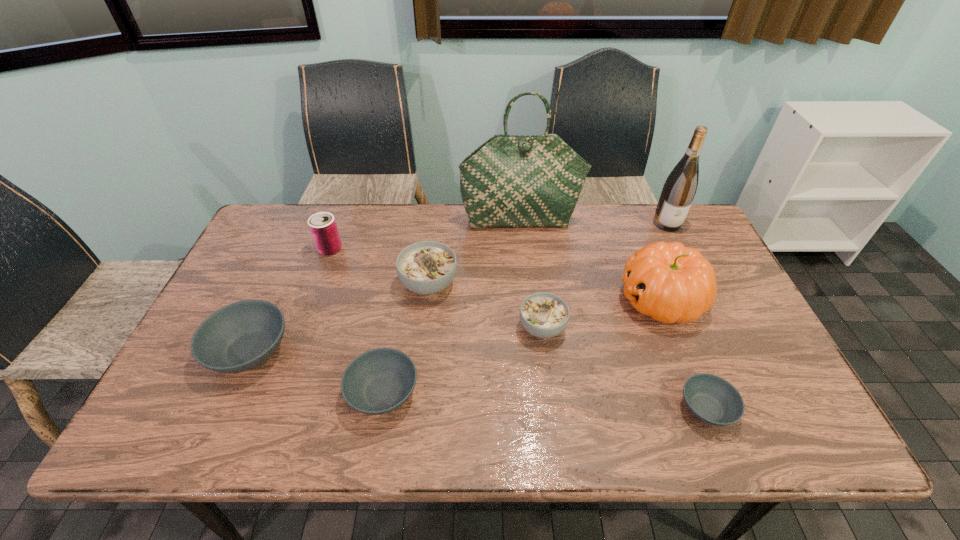
Image resolution: width=960 pixels, height=540 pixels. What are the coordinates of `vacant space located 0.270m on the carved face of the orange pumpkin` in the screenshot? It's located at (521, 299).

In order to click on free space located 0.250m on the carved face of the orange pumpkin in this screenshot , I will do `click(529, 299)`.

Locate an element on the screen. The image size is (960, 540). free region located on the carved face of the orange pumpkin is located at coordinates (521, 299).

I want to click on free location located 0.100m on the right of the third farthest object, so [x=374, y=249].

Locate an element on the screen. free space located 0.220m on the left of the bigger white soup bowl is located at coordinates (324, 284).

I want to click on free point located 0.310m on the right of the biggest gray soup bowl, so click(x=415, y=351).

The width and height of the screenshot is (960, 540). I want to click on vacant space located 0.090m on the back of the right white soup bowl, so click(537, 286).

The height and width of the screenshot is (540, 960). In order to click on blank space located on the left of the second gray soup bowl from left to right in this screenshot , I will do `click(193, 393)`.

At what (x,y) coordinates should I click in order to perform the action: click on vacant region located on the left of the shortest soup bowl. Please return your answer as a coordinate pair (x, y). Looking at the image, I should click on (594, 408).

Identify the location of tote bag present at the far edge. (510, 181).